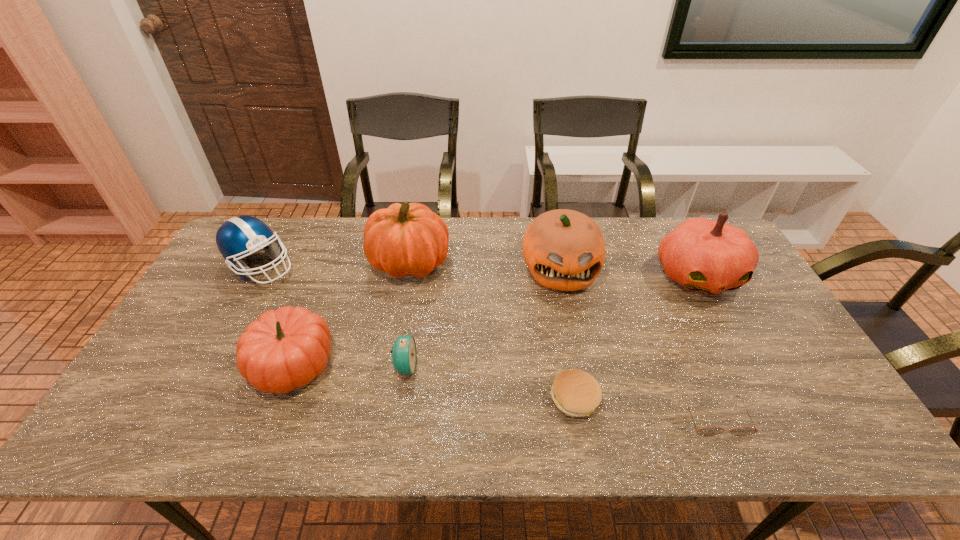
Find the location of a particular element. The width and height of the screenshot is (960, 540). vacant space positioned 0.310m on the front-facing side of the rightmost pumpkin is located at coordinates (764, 399).

Locate an element on the screen. This screenshot has height=540, width=960. free spot located on the face of the third pumpkin from left to right is located at coordinates [x=581, y=376].

Locate an element on the screen. The height and width of the screenshot is (540, 960). vacant space located at the front of the football helmet with the faceguard is located at coordinates (330, 267).

At what (x,y) coordinates should I click in order to perform the action: click on vacant space situated on the right of the shortest pumpkin. Please return your answer as a coordinate pair (x, y). Looking at the image, I should click on (466, 364).

I want to click on free space located 0.060m on the front-facing side of the alarm clock, so click(440, 367).

What are the coordinates of `vacant area situated 0.170m on the back of the patty` in the screenshot? It's located at (563, 327).

Where is `football helmet located at the far edge`? The width and height of the screenshot is (960, 540). football helmet located at the far edge is located at coordinates (238, 237).

Find the location of a particular element. patty located in the near edge section of the desktop is located at coordinates (576, 393).

Locate an element on the screen. sunglasses at the near edge is located at coordinates (708, 431).

This screenshot has height=540, width=960. In order to click on object present at the left edge in this screenshot , I will do [x=238, y=237].